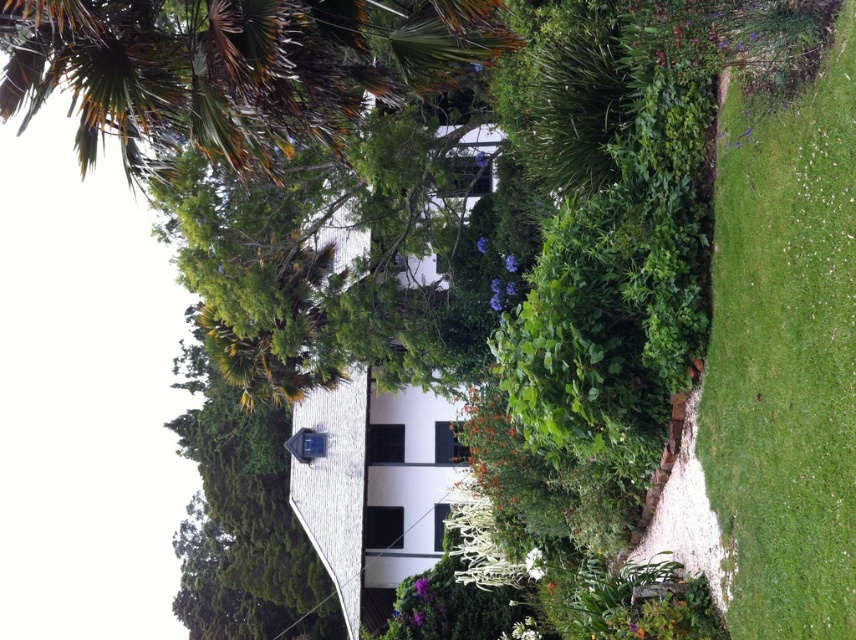
You are standing in the garden and want to walk towards the house. Which object, the green grass at right or the brown textured palm tree at upper left, is closer to you as you head towards the house?

The green grass at right is closer to the viewer than the brown textured palm tree at upper left, so it will be closer as you head towards the house.

You are standing at the entrance of the garden and want to walk towards the house. You see the green grass at right and the brown textured palm tree at upper left. Which direction should you walk to avoid the palm tree and head towards the house?

You should walk towards the right side, as the green grass at right is positioned to the right of the brown textured palm tree at upper left, indicating the path towards the house is in that direction.